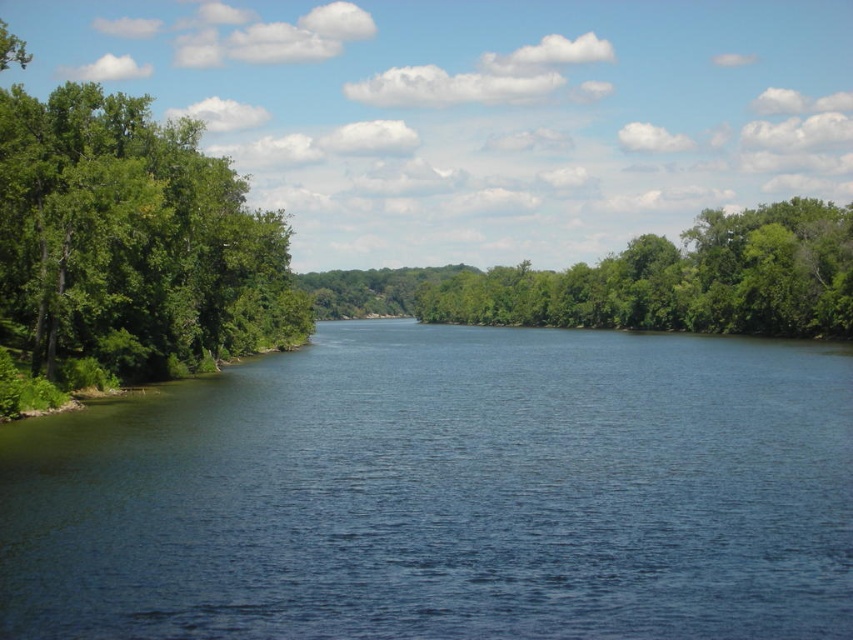
Question: Is blue water at center in front of green leafy trees at left?

Choices:
 (A) yes
 (B) no

Answer: (A)

Question: Is blue water at center thinner than green leafy trees at left?

Choices:
 (A) yes
 (B) no

Answer: (A)

Question: Can you confirm if green leafy trees at left is positioned to the right of green leafy tree at center?

Choices:
 (A) yes
 (B) no

Answer: (B)

Question: Estimate the real-world distances between objects in this image. Which object is farther from the green leafy trees at left?

Choices:
 (A) blue water at center
 (B) green leafy tree at center

Answer: (B)

Question: Which of the following is the closest to the observer?

Choices:
 (A) green leafy tree at center
 (B) blue water at center
 (C) green leafy trees at left

Answer: (B)

Question: Which object is positioned farthest from the green leafy trees at left?

Choices:
 (A) blue water at center
 (B) green leafy tree at center

Answer: (B)